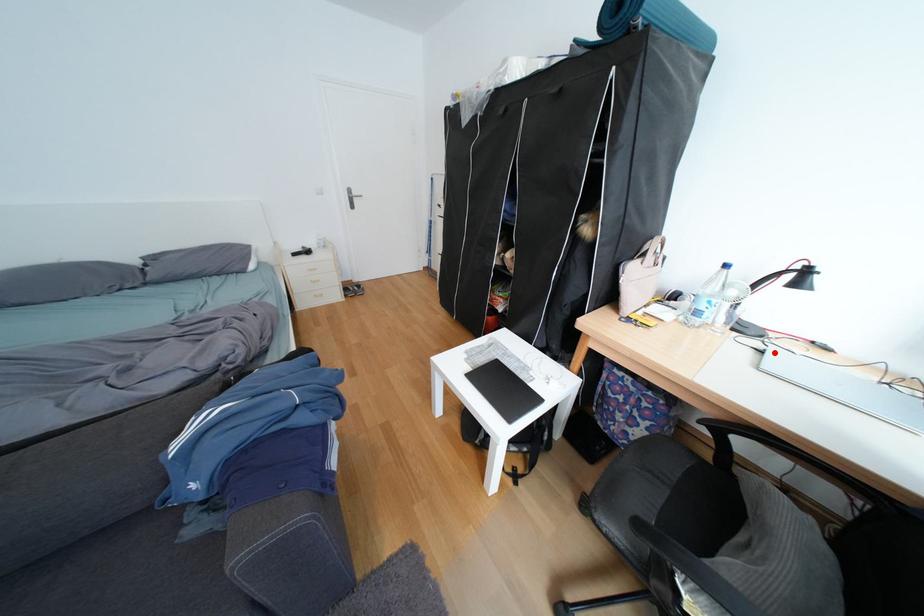
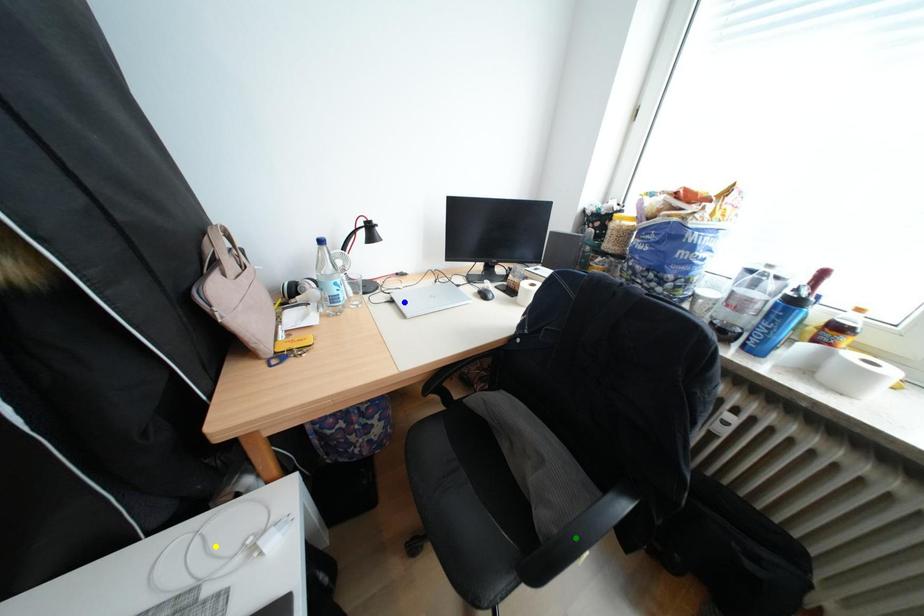
Question: I am providing you with two images of the same scene from different viewpoints. A red point is marked on the first image. You are given multiple points on the second image. Can you choose the point in image 2 that corresponds to the point in image 1?

Choices:
 (A) yellow point
 (B) green point
 (C) blue point

Answer: (C)